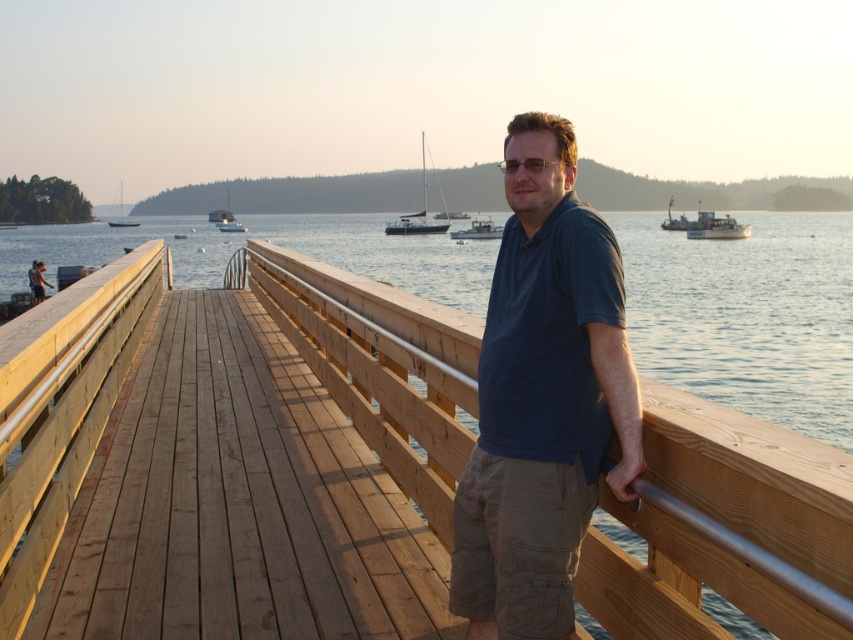
Can you confirm if wooden at center is bigger than dark blue shirt at center?

No.

Does wooden at center appear over dark blue shirt at center?

No, wooden at center is not above dark blue shirt at center.

Does point (627, 509) come in front of point (486, 499)?

Yes, it is.

The width and height of the screenshot is (853, 640). In order to click on wooden at center in this screenshot , I will do `click(724, 528)`.

Can you confirm if wooden at center is shorter than white glossy sailboat at upper left?

Yes, wooden at center is shorter than white glossy sailboat at upper left.

Who is shorter, wooden at center or white glossy sailboat at upper left?

wooden at center

Which is in front, point (370, 433) or point (227, 227)?

Point (370, 433)

Locate an element on the screen. The width and height of the screenshot is (853, 640). wooden at center is located at coordinates (724, 528).

Does white plastic boat at right appear on the right side of white sailboat at upper left?

Yes, white plastic boat at right is to the right of white sailboat at upper left.

Between point (708, 228) and point (119, 220), which one is positioned behind?

Point (119, 220)

At what (x,y) coordinates should I click in order to perform the action: click on white plastic boat at right. Please return your answer as a coordinate pair (x, y). The height and width of the screenshot is (640, 853). Looking at the image, I should click on (705, 225).